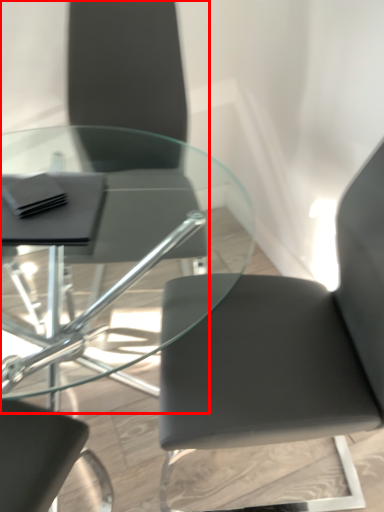
Question: From the image's perspective, what is the correct spatial positioning of chair (annotated by the red box) in reference to chair?

Choices:
 (A) below
 (B) above

Answer: (B)